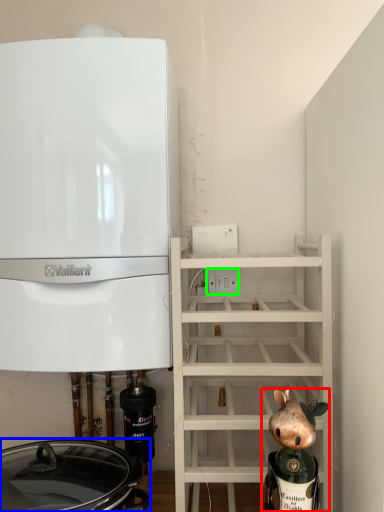
Question: Which object is the farthest from figurine (highlighted by a red box)? Choose among these: crock pot (highlighted by a blue box) or electric outlet (highlighted by a green box).

Choices:
 (A) crock pot
 (B) electric outlet

Answer: (B)